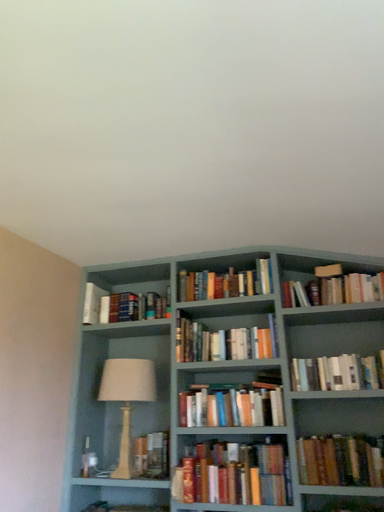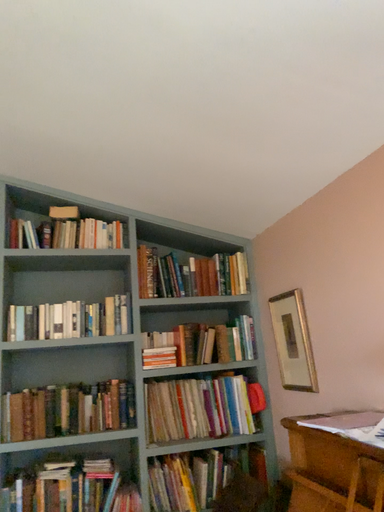
Question: Which way did the camera rotate in the video?

Choices:
 (A) rotated right
 (B) rotated left

Answer: (A)